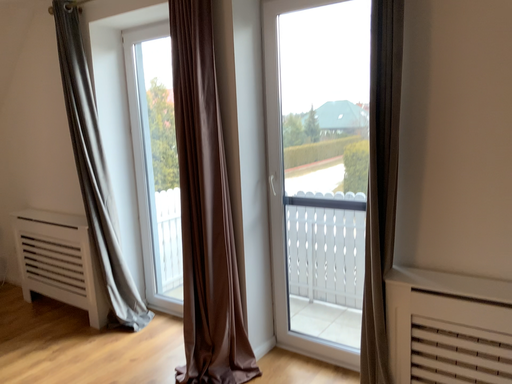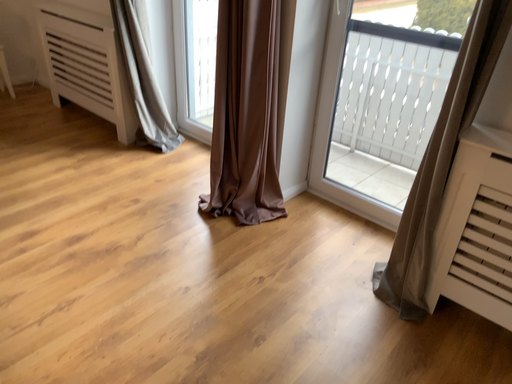
Question: How did the camera likely rotate when shooting the video?

Choices:
 (A) rotated upward
 (B) rotated downward

Answer: (B)